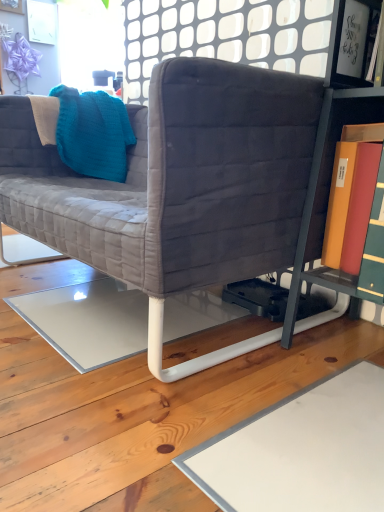
Question: Considering the positions of point (139, 286) and point (347, 40), is point (139, 286) closer or farther from the camera than point (347, 40)?

Choices:
 (A) farther
 (B) closer

Answer: (B)

Question: From a real-world perspective, is velvet gray couch at center above or below white glossy frame at upper right?

Choices:
 (A) above
 (B) below

Answer: (B)

Question: Which is farther from the velvet gray couch at center?

Choices:
 (A) white glossy frame at upper right
 (B) teal knitted throw pillow at upper left

Answer: (A)

Question: Which of these objects is positioned closest to the velvet gray couch at center?

Choices:
 (A) white glossy frame at upper right
 (B) teal knitted throw pillow at upper left

Answer: (B)